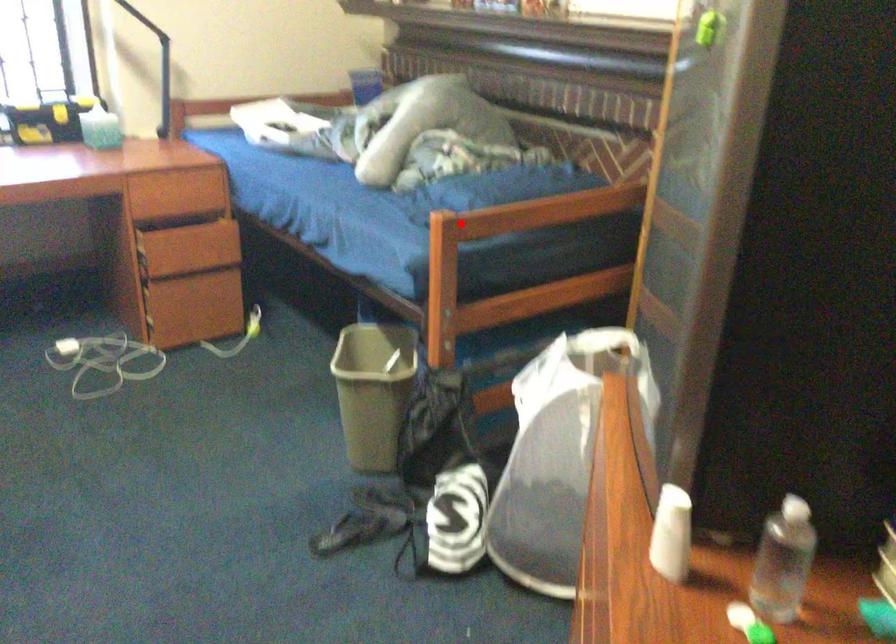
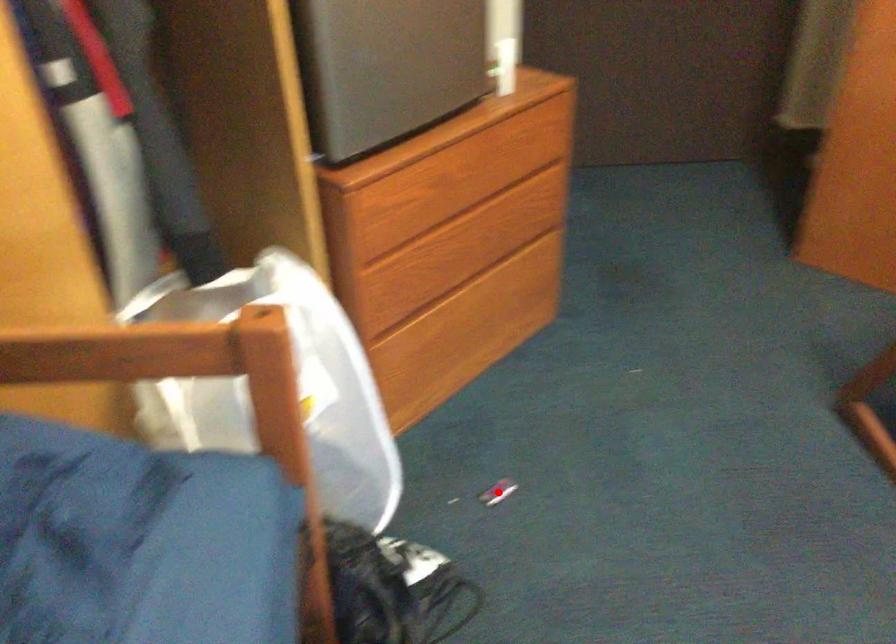
I am providing you with two images of the same scene from different viewpoints. A red point is marked on the first image and another point is marked on the second image. Is the red point in image1 aligned with the point shown in image2?

No